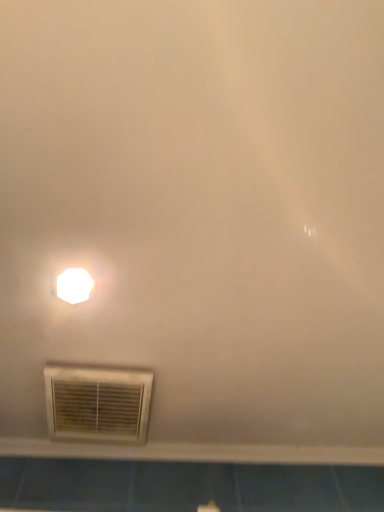
This screenshot has height=512, width=384. Identify the location of white plastic window sill at lower center. (193, 452).

Find the location of `white plastic window sill at lower center`. white plastic window sill at lower center is located at coordinates (193, 452).

Is white plastic window sill at lower center smaller than white glossy light fixture at upper left?

No.

From a real-world perspective, which object rests below the other?

white plastic window sill at lower center, from a real-world perspective.

From the picture: Can you confirm if white glossy light fixture at upper left is positioned to the right of white plastic window sill at lower center?

No, white glossy light fixture at upper left is not to the right of white plastic window sill at lower center.

Are white glossy light fixture at upper left and white plastic window sill at lower center located far from each other?

No, white glossy light fixture at upper left is in close proximity to white plastic window sill at lower center.

Considering the relative positions of white glossy light fixture at upper left and white plastic window sill at lower center in the image provided, is white glossy light fixture at upper left behind white plastic window sill at lower center?

No, it is in front of white plastic window sill at lower center.

Which of these two, white plastic air conditioning at lower left or white glossy light fixture at upper left, stands taller?

With more height is white plastic air conditioning at lower left.

Is white plastic air conditioning at lower left facing towards white glossy light fixture at upper left?

Yes, white plastic air conditioning at lower left is facing white glossy light fixture at upper left.

Could you measure the distance between white plastic air conditioning at lower left and white glossy light fixture at upper left?

They are 9.08 inches apart.

Who is more distant, white plastic air conditioning at lower left or white glossy light fixture at upper left?

white plastic air conditioning at lower left is behind.

Is white plastic window sill at lower center not inside white plastic air conditioning at lower left?

Yes, white plastic window sill at lower center is outside of white plastic air conditioning at lower left.

From the image's perspective, does white plastic window sill at lower center appear higher than white plastic air conditioning at lower left?

Actually, white plastic window sill at lower center appears below white plastic air conditioning at lower left in the image.

From a real-world perspective, relative to white plastic air conditioning at lower left, is white plastic window sill at lower center vertically above or below?

white plastic window sill at lower center is above white plastic air conditioning at lower left.

Considering the positions of objects white plastic window sill at lower center and white plastic air conditioning at lower left in the image provided, who is in front, white plastic window sill at lower center or white plastic air conditioning at lower left?

white plastic air conditioning at lower left is closer to the camera.

Is white glossy light fixture at upper left to the left of white plastic air conditioning at lower left from the viewer's perspective?

Yes, white glossy light fixture at upper left is to the left of white plastic air conditioning at lower left.

Is white glossy light fixture at upper left wider than white plastic air conditioning at lower left?

In fact, white glossy light fixture at upper left might be narrower than white plastic air conditioning at lower left.

Is white plastic air conditioning at lower left outside of white plastic window sill at lower center?

Indeed, white plastic air conditioning at lower left is completely outside white plastic window sill at lower center.

Looking at this image, is white plastic air conditioning at lower left wider than white plastic window sill at lower center?

Yes.

Considering the points (98, 420) and (85, 445), which point is behind, point (98, 420) or point (85, 445)?

Positioned behind is point (85, 445).

How different are the orientations of white plastic air conditioning at lower left and white plastic window sill at lower center in degrees?

They differ by 1.42 degrees in their facing directions.

The image size is (384, 512). In order to click on window sill on the right side of white glossy light fixture at upper left in this screenshot , I will do `click(193, 452)`.

In order to click on lamp in front of the white plastic window sill at lower center in this screenshot , I will do `click(74, 285)`.

From the image, which object appears to be farther from white glossy light fixture at upper left, white plastic window sill at lower center or white plastic air conditioning at lower left?

white plastic window sill at lower center lies further to white glossy light fixture at upper left than the other object.

Based on their spatial positions, is white plastic air conditioning at lower left or white plastic window sill at lower center further from white glossy light fixture at upper left?

white plastic window sill at lower center is further to white glossy light fixture at upper left.

From the image, which object appears to be farther from white plastic air conditioning at lower left, white plastic window sill at lower center or white glossy light fixture at upper left?

white glossy light fixture at upper left lies further to white plastic air conditioning at lower left than the other object.

From the image, which object appears to be farther from white plastic air conditioning at lower left, white glossy light fixture at upper left or white plastic window sill at lower center?

white glossy light fixture at upper left is positioned further to the anchor white plastic air conditioning at lower left.

From the image, which object appears to be nearer to white plastic window sill at lower center, white plastic air conditioning at lower left or white glossy light fixture at upper left?

white plastic air conditioning at lower left.

Estimate the real-world distances between objects in this image. Which object is further from white plastic window sill at lower center, white glossy light fixture at upper left or white plastic air conditioning at lower left?

The object further to white plastic window sill at lower center is white glossy light fixture at upper left.

Locate an element on the screen. air conditioning between white glossy light fixture at upper left and white plastic window sill at lower center vertically is located at coordinates (97, 403).